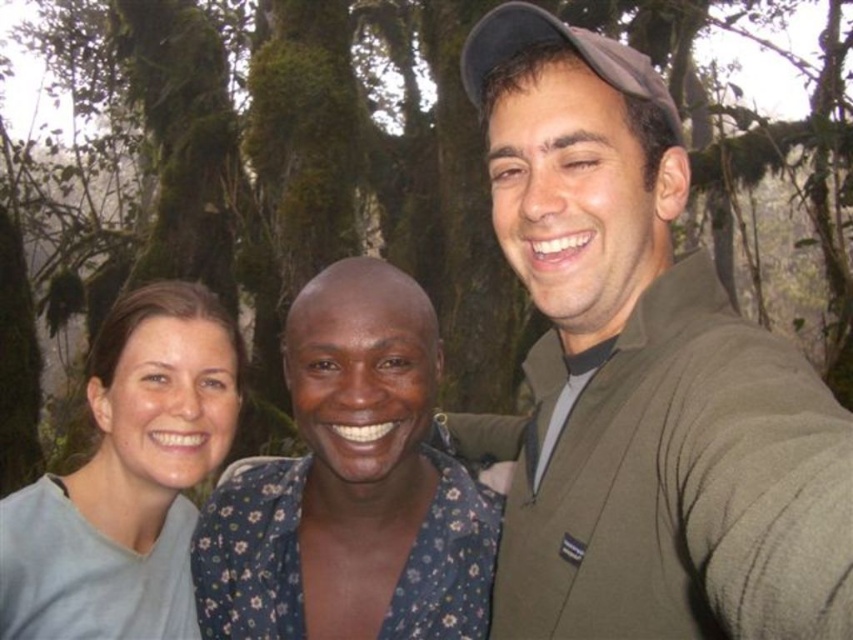
How distant is green mossy tree at center from green sweater at center?

They are 6.53 meters apart.

Is point (216, 257) closer to camera compared to point (494, 97)?

No, it is behind (494, 97).

The image size is (853, 640). In order to click on green mossy tree at center in this screenshot , I will do `click(248, 188)`.

Can you confirm if green mossy tree at center is positioned to the left of light gray fabric at left?

Correct, you'll find green mossy tree at center to the left of light gray fabric at left.

Is point (67, 179) behind point (135, 317)?

Yes, it is.

Between point (41, 452) and point (28, 506), which one is positioned in front?

Point (28, 506) is in front.

Image resolution: width=853 pixels, height=640 pixels. In order to click on green mossy tree at center in this screenshot , I will do `click(248, 188)`.

Who is lower down, green mossy tree at center or matte gray shirt at center?

matte gray shirt at center

Can you confirm if green mossy tree at center is positioned to the left of matte gray shirt at center?

Yes, green mossy tree at center is to the left of matte gray shirt at center.

Between point (125, 13) and point (376, 417), which one is positioned in front?

Point (376, 417)

This screenshot has width=853, height=640. Find the location of `green mossy tree at center`. green mossy tree at center is located at coordinates (248, 188).